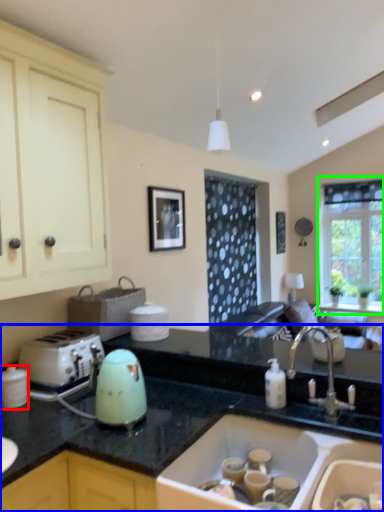
Question: Based on their relative distances, which object is nearer to kitchen appliance (highlighted by a red box)? Choose from countertop (highlighted by a blue box) and window (highlighted by a green box).

Choices:
 (A) countertop
 (B) window

Answer: (A)